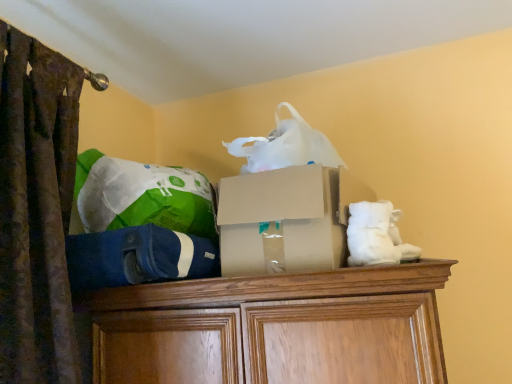
The width and height of the screenshot is (512, 384). What do you see at coordinates (140, 196) in the screenshot?
I see `green fabric bean bag chair at upper left, positioned as the second bean bag chair in bottom-to-top order` at bounding box center [140, 196].

Find the location of a particular element. green fabric bean bag chair at upper left, positioned as the second bean bag chair in bottom-to-top order is located at coordinates (140, 196).

Find the location of a particular element. blue fabric bean bag chair at center, which is the first bean bag chair in bottom-to-top order is located at coordinates (137, 257).

Does blue fabric bean bag chair at center, which is the first bean bag chair in bottom-to-top order, touch cardboard box at center?

No, blue fabric bean bag chair at center, which is the first bean bag chair in bottom-to-top order, is not beside cardboard box at center.

Is cardboard box at center surrounded by blue fabric bean bag chair at center, acting as the second bean bag chair starting from the top?

No.

How distant is blue fabric bean bag chair at center, acting as the second bean bag chair starting from the top, from cardboard box at center?

blue fabric bean bag chair at center, acting as the second bean bag chair starting from the top, and cardboard box at center are 7.62 inches apart from each other.

From the image's perspective, is blue fabric bean bag chair at center, acting as the second bean bag chair starting from the top, under cardboard box at center?

Yes, from the image's perspective, blue fabric bean bag chair at center, acting as the second bean bag chair starting from the top, is beneath cardboard box at center.

Does point (258, 255) lie in front of point (194, 276)?

Yes, point (258, 255) is in front of point (194, 276).

From the image's perspective, relative to blue fabric bean bag chair at center, acting as the second bean bag chair starting from the top, is cardboard box at center above or below?

From the image's perspective, cardboard box at center appears above blue fabric bean bag chair at center, acting as the second bean bag chair starting from the top.

Can you confirm if cardboard box at center is wider than blue fabric bean bag chair at center, acting as the second bean bag chair starting from the top?

Yes.

How distant is cardboard box at center from blue fabric bean bag chair at center, acting as the second bean bag chair starting from the top?

cardboard box at center and blue fabric bean bag chair at center, acting as the second bean bag chair starting from the top, are 7.62 inches apart.

This screenshot has width=512, height=384. I want to click on storage box below the green fabric bean bag chair at upper left, which is the first bean bag chair in top-to-bottom order (from a real-world perspective), so click(x=284, y=218).

Which object is closer to the camera, cardboard box at center or green fabric bean bag chair at upper left, which is the first bean bag chair in top-to-bottom order?

cardboard box at center is closer to the camera.

Consider the image. From a real-world perspective, between cardboard box at center and green fabric bean bag chair at upper left, which is the first bean bag chair in top-to-bottom order, who is vertically higher?

In real-world perspective, green fabric bean bag chair at upper left, which is the first bean bag chair in top-to-bottom order, is above.

Would you say cardboard box at center contains green fabric bean bag chair at upper left, positioned as the second bean bag chair in bottom-to-top order?

No, green fabric bean bag chair at upper left, positioned as the second bean bag chair in bottom-to-top order, is not a part of cardboard box at center.

Image resolution: width=512 pixels, height=384 pixels. What are the coordinates of `bean bag chair lying in front of the green fabric bean bag chair at upper left, positioned as the second bean bag chair in bottom-to-top order` in the screenshot? It's located at (137, 257).

Is green fabric bean bag chair at upper left, which is the first bean bag chair in top-to-bottom order, bigger than blue fabric bean bag chair at center, which is the first bean bag chair in bottom-to-top order?

Correct, green fabric bean bag chair at upper left, which is the first bean bag chair in top-to-bottom order, is larger in size than blue fabric bean bag chair at center, which is the first bean bag chair in bottom-to-top order.

Between point (76, 188) and point (93, 279), which one is positioned in front?

The point (93, 279) is more forward.

Is green fabric bean bag chair at upper left, which is the first bean bag chair in top-to-bottom order, wider or thinner than blue fabric bean bag chair at center, which is the first bean bag chair in bottom-to-top order?

Considering their sizes, green fabric bean bag chair at upper left, which is the first bean bag chair in top-to-bottom order, looks slimmer than blue fabric bean bag chair at center, which is the first bean bag chair in bottom-to-top order.

Which of these two, green fabric bean bag chair at upper left, positioned as the second bean bag chair in bottom-to-top order, or cardboard box at center, is smaller?

green fabric bean bag chair at upper left, positioned as the second bean bag chair in bottom-to-top order, is smaller.

Can you tell me how much green fabric bean bag chair at upper left, positioned as the second bean bag chair in bottom-to-top order, and cardboard box at center differ in facing direction?

2.26 degrees.

Is green fabric bean bag chair at upper left, positioned as the second bean bag chair in bottom-to-top order, positioned in front of cardboard box at center?

No, it is behind cardboard box at center.

From the image's perspective, would you say green fabric bean bag chair at upper left, which is the first bean bag chair in top-to-bottom order, is positioned over cardboard box at center?

Yes, from the image's perspective, green fabric bean bag chair at upper left, which is the first bean bag chair in top-to-bottom order, is on top of cardboard box at center.

Considering the relative sizes of blue fabric bean bag chair at center, which is the first bean bag chair in bottom-to-top order, and green fabric bean bag chair at upper left, which is the first bean bag chair in top-to-bottom order, in the image provided, is blue fabric bean bag chair at center, which is the first bean bag chair in bottom-to-top order, wider than green fabric bean bag chair at upper left, which is the first bean bag chair in top-to-bottom order,?

Yes, blue fabric bean bag chair at center, which is the first bean bag chair in bottom-to-top order, is wider than green fabric bean bag chair at upper left, which is the first bean bag chair in top-to-bottom order.

In the image, is blue fabric bean bag chair at center, acting as the second bean bag chair starting from the top, on the left side or the right side of green fabric bean bag chair at upper left, positioned as the second bean bag chair in bottom-to-top order?

blue fabric bean bag chair at center, acting as the second bean bag chair starting from the top, is positioned on green fabric bean bag chair at upper left, positioned as the second bean bag chair in bottom-to-top order,'s right side.

From the image's perspective, between blue fabric bean bag chair at center, which is the first bean bag chair in bottom-to-top order, and green fabric bean bag chair at upper left, positioned as the second bean bag chair in bottom-to-top order, who is located below?

blue fabric bean bag chair at center, which is the first bean bag chair in bottom-to-top order, from the image's perspective.

From a real-world perspective, does blue fabric bean bag chair at center, which is the first bean bag chair in bottom-to-top order, stand above green fabric bean bag chair at upper left, which is the first bean bag chair in top-to-bottom order?

Actually, blue fabric bean bag chair at center, which is the first bean bag chair in bottom-to-top order, is physically below green fabric bean bag chair at upper left, which is the first bean bag chair in top-to-bottom order, in the real world.

Locate an element on the screen. storage box that is on the right side of blue fabric bean bag chair at center, acting as the second bean bag chair starting from the top is located at coordinates (284, 218).

The width and height of the screenshot is (512, 384). Identify the location of storage box above the blue fabric bean bag chair at center, which is the first bean bag chair in bottom-to-top order (from the image's perspective). (284, 218).

Estimate the real-world distances between objects in this image. Which object is further from blue fabric bean bag chair at center, acting as the second bean bag chair starting from the top, green fabric bean bag chair at upper left, which is the first bean bag chair in top-to-bottom order, or cardboard box at center?

Among the two, cardboard box at center is located further to blue fabric bean bag chair at center, acting as the second bean bag chair starting from the top.

Estimate the real-world distances between objects in this image. Which object is further from cardboard box at center, blue fabric bean bag chair at center, which is the first bean bag chair in bottom-to-top order, or green fabric bean bag chair at upper left, positioned as the second bean bag chair in bottom-to-top order?

The object further to cardboard box at center is green fabric bean bag chair at upper left, positioned as the second bean bag chair in bottom-to-top order.

Looking at the image, which one is located closer to cardboard box at center, green fabric bean bag chair at upper left, positioned as the second bean bag chair in bottom-to-top order, or blue fabric bean bag chair at center, acting as the second bean bag chair starting from the top?

The object closer to cardboard box at center is blue fabric bean bag chair at center, acting as the second bean bag chair starting from the top.

Looking at the image, which one is located further to blue fabric bean bag chair at center, acting as the second bean bag chair starting from the top, cardboard box at center or green fabric bean bag chair at upper left, which is the first bean bag chair in top-to-bottom order?

Among the two, cardboard box at center is located further to blue fabric bean bag chair at center, acting as the second bean bag chair starting from the top.

From the picture: Considering their positions, is cardboard box at center positioned closer to green fabric bean bag chair at upper left, which is the first bean bag chair in top-to-bottom order, than blue fabric bean bag chair at center, acting as the second bean bag chair starting from the top?

blue fabric bean bag chair at center, acting as the second bean bag chair starting from the top, lies closer to green fabric bean bag chair at upper left, which is the first bean bag chair in top-to-bottom order, than the other object.

From the image, which object appears to be nearer to green fabric bean bag chair at upper left, positioned as the second bean bag chair in bottom-to-top order, blue fabric bean bag chair at center, which is the first bean bag chair in bottom-to-top order, or cardboard box at center?

Based on the image, blue fabric bean bag chair at center, which is the first bean bag chair in bottom-to-top order, appears to be nearer to green fabric bean bag chair at upper left, positioned as the second bean bag chair in bottom-to-top order.

At what (x,y) coordinates should I click in order to perform the action: click on bean bag chair located between green fabric bean bag chair at upper left, positioned as the second bean bag chair in bottom-to-top order, and cardboard box at center in the left-right direction. Please return your answer as a coordinate pair (x, y). Looking at the image, I should click on (137, 257).